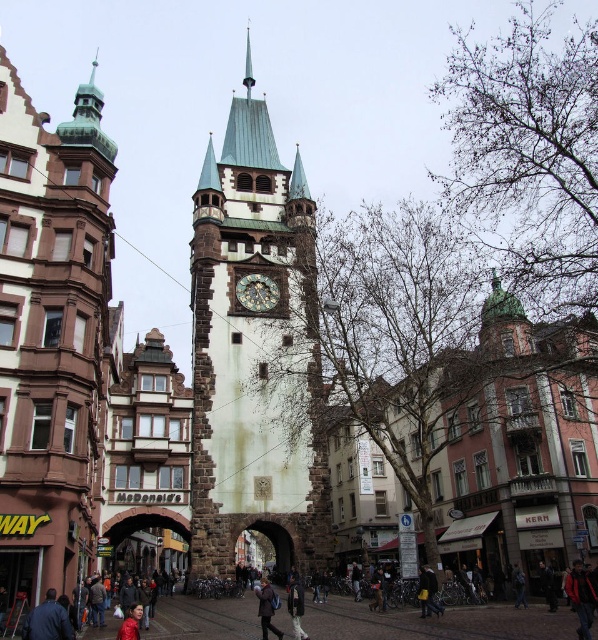
Question: Which object is the farthest from the dark blue coat at lower center?

Choices:
 (A) dark blue coat at center
 (B) stone clock tower at center

Answer: (B)

Question: Considering the real-world distances, which object is farthest from the dark brown wooden clock at center?

Choices:
 (A) stone clock tower at center
 (B) dark blue coat at lower center
 (C) dark blue coat at center

Answer: (B)

Question: Can you confirm if dark brown wooden clock at center is positioned above dark blue coat at center?

Choices:
 (A) yes
 (B) no

Answer: (A)

Question: In this image, where is stone clock tower at center located relative to dark brown wooden clock at center?

Choices:
 (A) left
 (B) right

Answer: (A)

Question: Does dark blue coat at lower center have a greater width compared to dark brown wooden clock at center?

Choices:
 (A) no
 (B) yes

Answer: (B)

Question: Estimate the real-world distances between objects in this image. Which object is closer to the dark brown wooden clock at center?

Choices:
 (A) dark blue coat at center
 (B) dark blue coat at lower center
 (C) stone clock tower at center

Answer: (C)